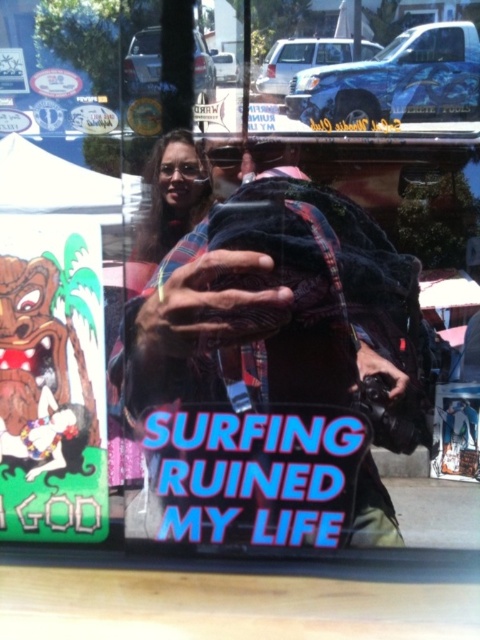
You are a photographer trying to capture the plaid fabric at center and the white paper poster at center in a single shot. Based on the scene description, which object should you focus on first to ensure both are in frame?

The plaid fabric at center is located above the white paper poster at center, so you should focus on the plaid fabric at center first to ensure both are in frame.

You are organizing a photo shoot and need to position the velvet black jacket at center and the green paper sign at lower left in a way that they are both visible in the frame. Based on their current positions, which object is on the right side of the other?

The velvet black jacket at center is to the right of green paper sign at lower left.

You are standing in front of a reflective surface and see the plaid fabric at center and the white paper poster at center. Which object takes up more space in the scene?

The plaid fabric at center is bigger than the white paper poster at center, so it takes up more space in the scene.